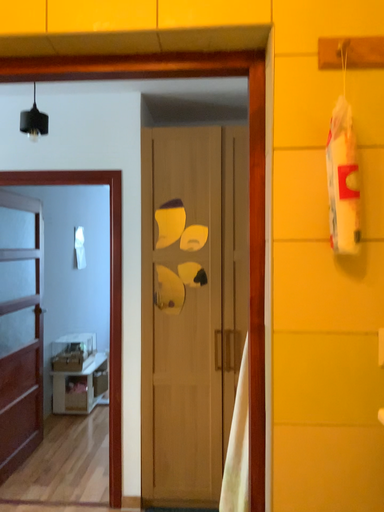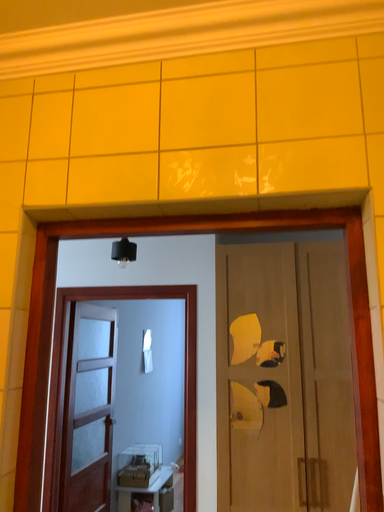
Question: Which way did the camera rotate in the video?

Choices:
 (A) rotated right
 (B) rotated left

Answer: (B)